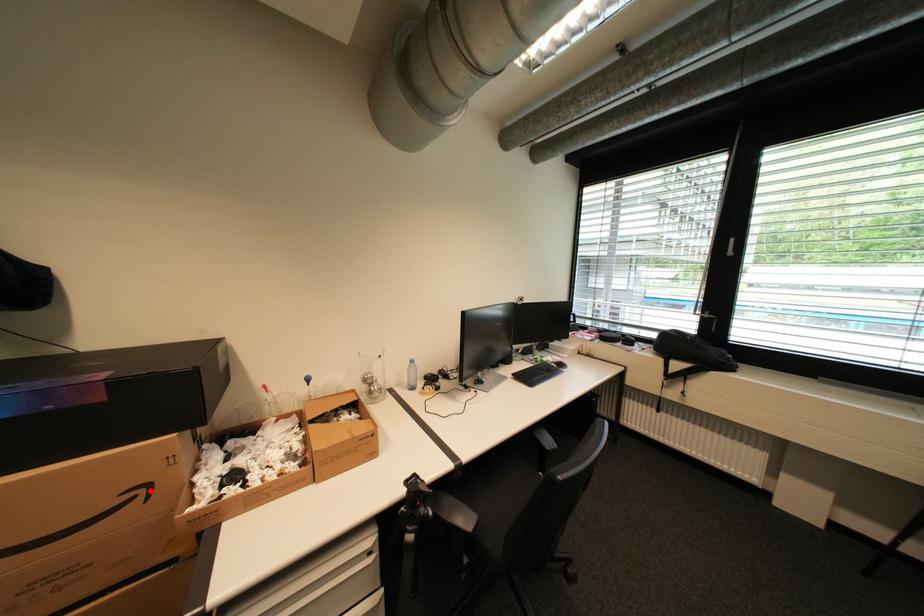
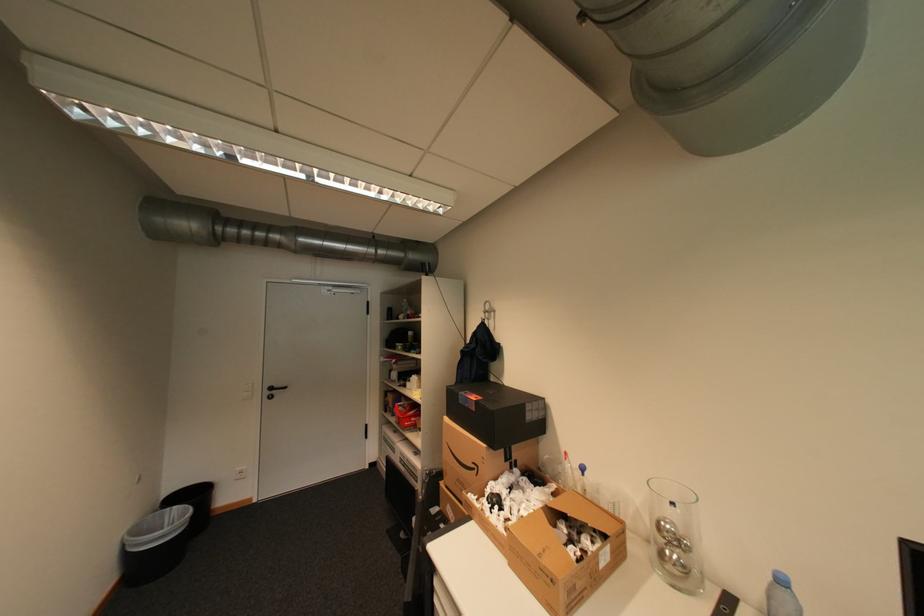
Find the pixel in the second image that matches the highlighted location in the first image.

(484, 468)